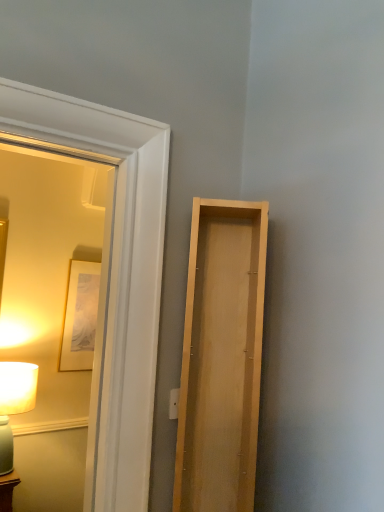
Question: From the image's perspective, is matte wooden mirror at left located above matte white lamp at left?

Choices:
 (A) yes
 (B) no

Answer: (A)

Question: Is matte wooden mirror at left not inside matte white lamp at left?

Choices:
 (A) no
 (B) yes

Answer: (B)

Question: Considering the relative sizes of matte wooden mirror at left and matte white lamp at left in the image provided, is matte wooden mirror at left smaller than matte white lamp at left?

Choices:
 (A) no
 (B) yes

Answer: (A)

Question: Is matte wooden mirror at left shorter than matte white lamp at left?

Choices:
 (A) no
 (B) yes

Answer: (A)

Question: Is matte wooden mirror at left placed right next to matte white lamp at left?

Choices:
 (A) no
 (B) yes

Answer: (A)

Question: Considering the positions of matte wooden mirror at left and light wood door at right in the image, is matte wooden mirror at left bigger or smaller than light wood door at right?

Choices:
 (A) small
 (B) big

Answer: (B)

Question: In the image, is matte wooden mirror at left positioned in front of or behind light wood door at right?

Choices:
 (A) behind
 (B) front

Answer: (B)

Question: Is matte wooden mirror at left situated inside light wood door at right or outside?

Choices:
 (A) outside
 (B) inside

Answer: (A)

Question: In terms of height, does matte wooden mirror at left look taller or shorter compared to light wood door at right?

Choices:
 (A) short
 (B) tall

Answer: (B)

Question: Would you say light wood door at right is to the left or to the right of matte white lamp at left in the picture?

Choices:
 (A) right
 (B) left

Answer: (A)

Question: Is light wood door at right wider or thinner than matte white lamp at left?

Choices:
 (A) wide
 (B) thin

Answer: (B)

Question: From a real-world perspective, is light wood door at right positioned above or below matte white lamp at left?

Choices:
 (A) below
 (B) above

Answer: (B)

Question: Is light wood door at right situated inside matte white lamp at left or outside?

Choices:
 (A) outside
 (B) inside

Answer: (A)

Question: From a real-world perspective, is light wood door at right physically located above or below matte wooden mirror at left?

Choices:
 (A) above
 (B) below

Answer: (B)

Question: From the image's perspective, is light wood door at right above or below matte wooden mirror at left?

Choices:
 (A) below
 (B) above

Answer: (A)